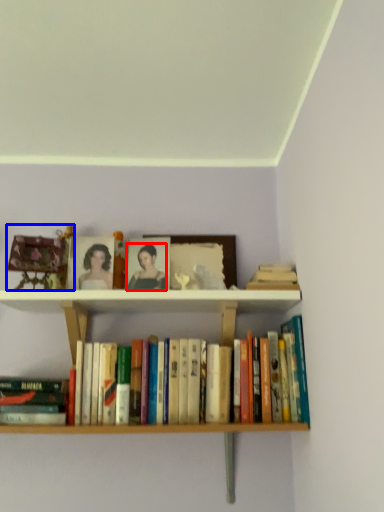
Question: Which of the following is the closest to the observer, person (highlighted by a red box) or toy (highlighted by a blue box)?

Choices:
 (A) person
 (B) toy

Answer: (B)